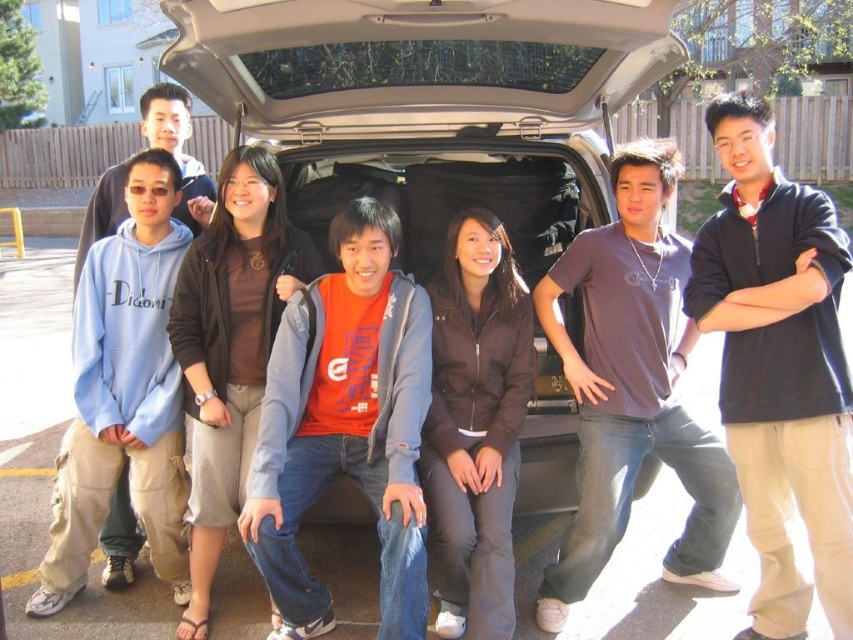
You are standing at the point with coordinates point (430, 104) in the image. What object is located at this point? Please answer with the object label from the scene description.

The point (430, 104) corresponds to the black fabric minivan at center.